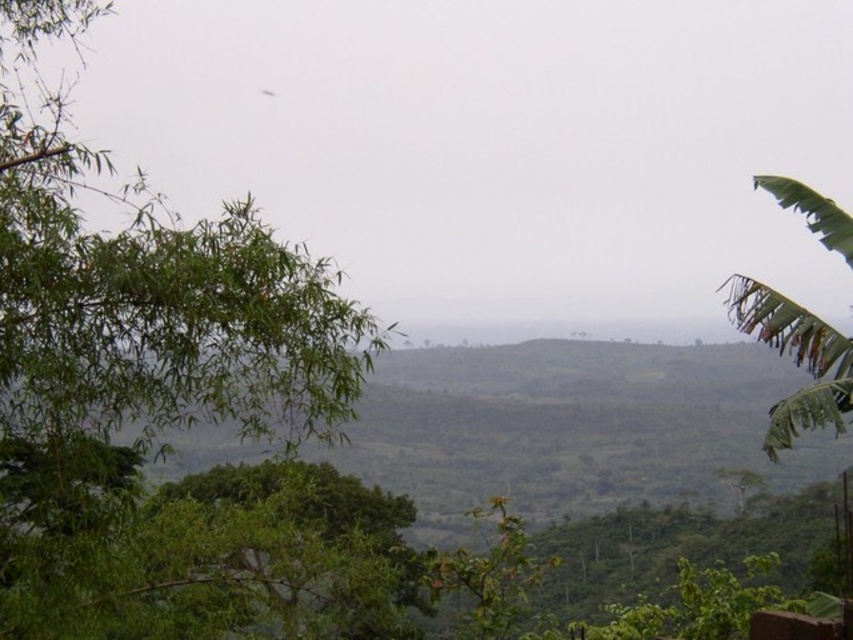
Question: Is green leafy tree at upper left in front of green leafy tree at right?

Choices:
 (A) no
 (B) yes

Answer: (B)

Question: Does green leafy tree at upper left have a larger size compared to green leafy tree at right?

Choices:
 (A) yes
 (B) no

Answer: (A)

Question: Does green leafy tree at upper left lie behind green leafy tree at right?

Choices:
 (A) yes
 (B) no

Answer: (B)

Question: Which point is farther to the camera?

Choices:
 (A) (735, 292)
 (B) (264, 410)

Answer: (A)